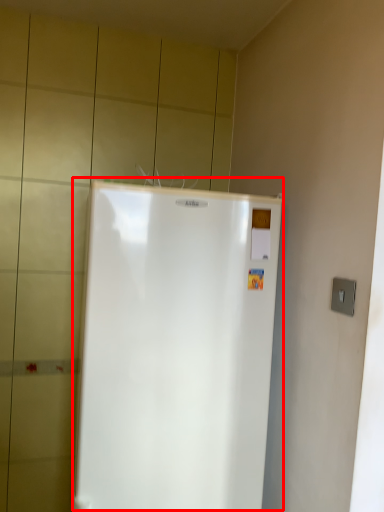
Question: From the image, what is the correct spatial relationship of refrigerator (annotated by the red box) in relation to electric outlet?

Choices:
 (A) right
 (B) left

Answer: (B)